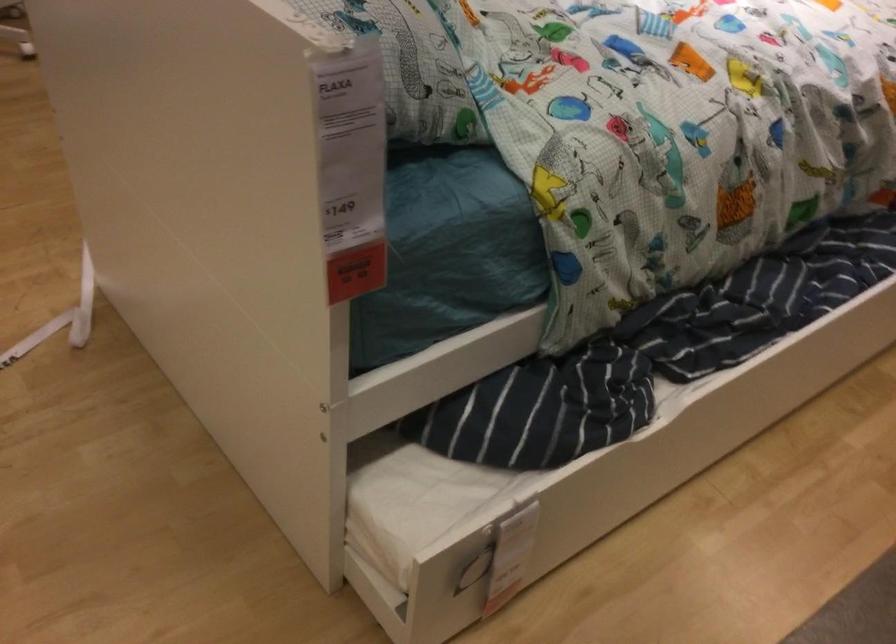
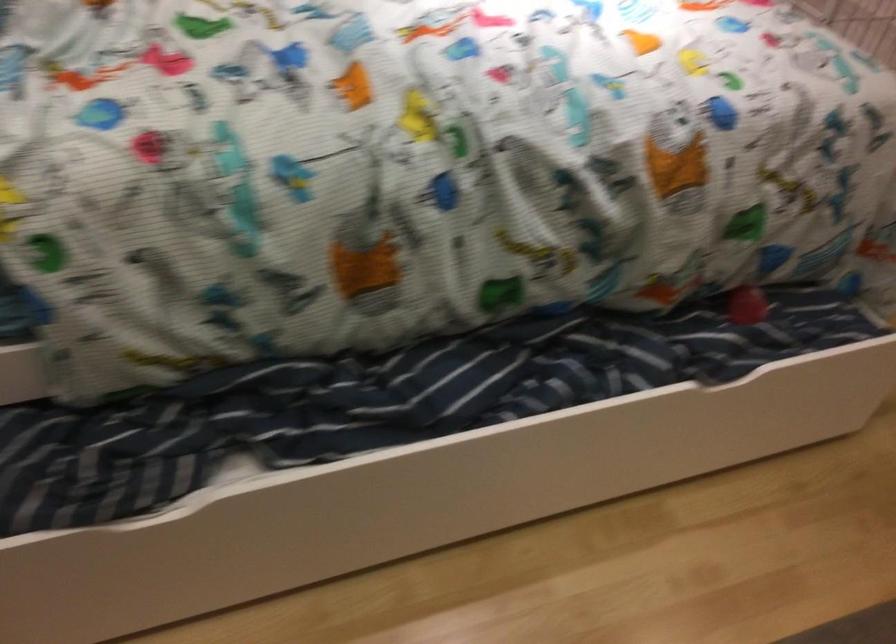
The images are taken continuously from a first-person perspective. In which direction are you moving?

The cameraman moved toward right, forward.